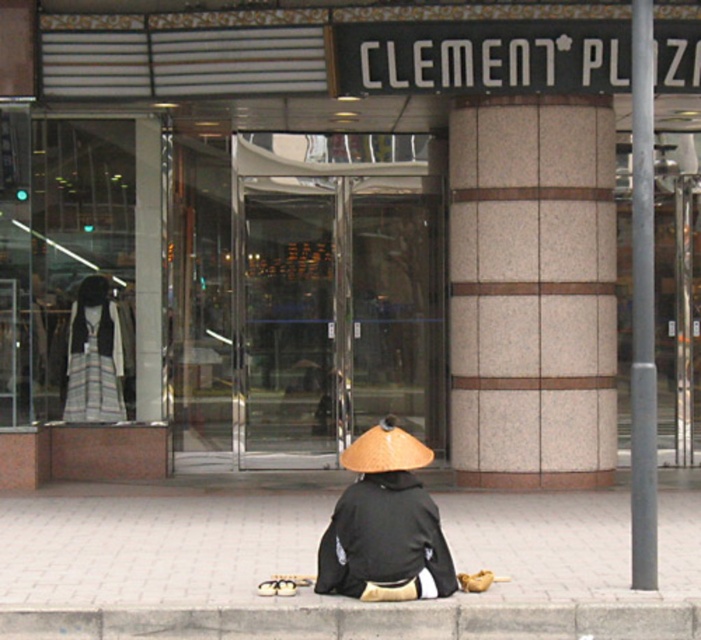
Question: Which object is farther from the camera taking this photo?

Choices:
 (A) striped cotton sweatshirt at center
 (B) smooth concrete pavement at lower center

Answer: (A)

Question: Can you confirm if gray concrete curb at lower center is bigger than black matte kimono at center?

Choices:
 (A) no
 (B) yes

Answer: (A)

Question: Considering the real-world distances, which object is farthest from the striped cotton sweatshirt at center?

Choices:
 (A) gray concrete curb at lower center
 (B) metallic gray pole at right

Answer: (B)

Question: Does striped fabric kimono at center lie behind natural straw hat at lower center?

Choices:
 (A) no
 (B) yes

Answer: (B)

Question: Observing the image, what is the correct spatial positioning of striped fabric kimono at center in reference to striped cotton sweatshirt at center?

Choices:
 (A) above
 (B) below

Answer: (B)

Question: Which point is farther to the camera?

Choices:
 (A) (107, 637)
 (B) (648, 330)
 (C) (409, 442)

Answer: (B)